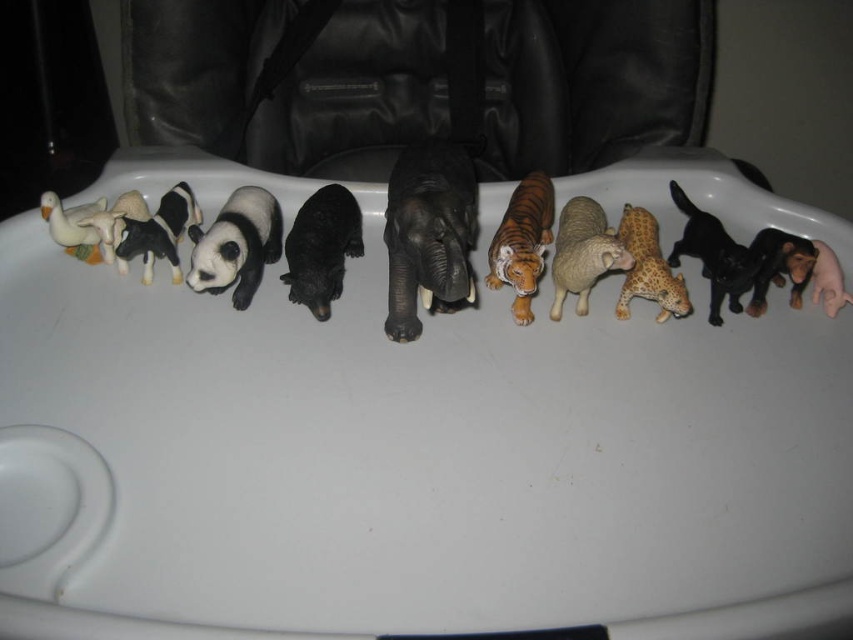
Does point (460, 296) come closer to viewer compared to point (149, 244)?

Yes.

Is black rubber elephant at center above black glossy cow at left?

No.

Find the location of `black rubber elephant at center`. black rubber elephant at center is located at coordinates (428, 234).

What are the coordinates of `black rubber elephant at center` in the screenshot? It's located at (428, 234).

Between point (711, 298) and point (166, 234), which one is positioned behind?

Point (711, 298)

Who is higher up, black plastic panther at right or black glossy cow at left?

Positioned higher is black glossy cow at left.

Is point (721, 227) more distant than point (183, 220)?

No, (721, 227) is closer to viewer.

The image size is (853, 640). I want to click on black plastic panther at right, so click(x=712, y=256).

In the scene shown: Measure the distance between point (136, 294) and camera.

37.85 inches

Which is more to the left, white plastic bathtub at center or black glossy cow at left?

black glossy cow at left is more to the left.

Image resolution: width=853 pixels, height=640 pixels. Identify the location of white plastic bathtub at center. (410, 461).